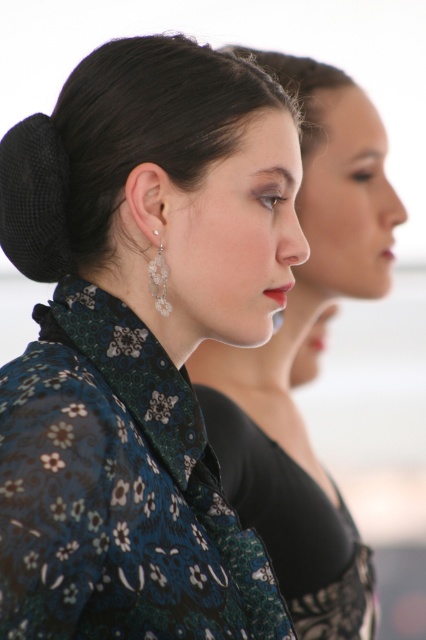
You are a photographer trying to capture the best angle of the two individuals in the scene. Which object, the black netted bun at upper center or the black textured hair at center, should you focus on to ensure it appears taller in the photo?

The black netted bun at upper center has a greater height compared to the black textured hair at center, so focusing on it will ensure it appears taller in the photo.

You are taking a photo of two people in a scene. You notice two points marked as point 1 at coordinates [115,209] and point 2 at coordinates [264,67]. Which point is closer to the camera?

Point 1 at coordinates [115,209] is closer to the camera than point 2 at coordinates [264,67].